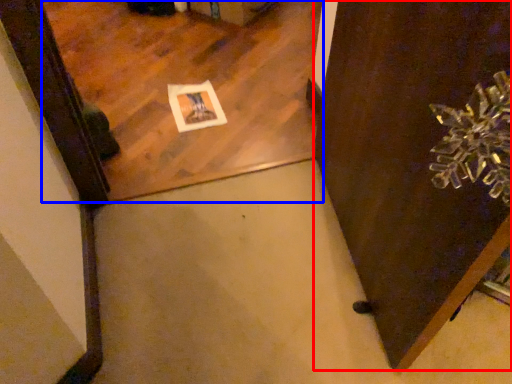
Question: Which object appears closest to the camera in this image, door (highlighted by a red box) or mirror (highlighted by a blue box)?

Choices:
 (A) door
 (B) mirror

Answer: (A)